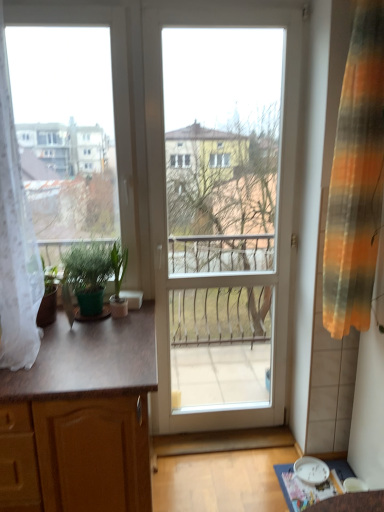
At what (x,y) coordinates should I click in order to perform the action: click on free space to the right of white lace curtain at left, acting as the second curtain starting from the right. Please return your answer as a coordinate pair (x, y). Looking at the image, I should click on (86, 345).